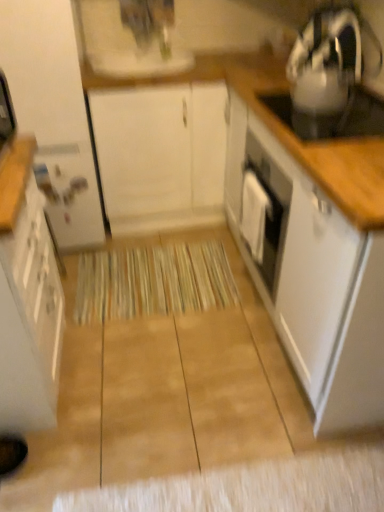
Question: From the image's perspective, relative to metallic silver kettle at upper right, is beige textured mat at center above or below?

Choices:
 (A) below
 (B) above

Answer: (A)

Question: Considering the positions of beige textured mat at center and metallic silver kettle at upper right in the image, is beige textured mat at center wider or thinner than metallic silver kettle at upper right?

Choices:
 (A) thin
 (B) wide

Answer: (B)

Question: Which of these objects is positioned farthest from the white glossy cabinet at left, which ranks as the 1th cabinetry in left-to-right order?

Choices:
 (A) white glossy cabinet at left, the third cabinetry from the right
 (B) beige textured mat at center
 (C) white glossy sink at upper center
 (D) white matte cabinet at center, the 2th cabinetry when ordered from right to left
 (E) white glossy cabinet at right, arranged as the first cabinetry when viewed from the right

Answer: (E)

Question: Which object is positioned farthest from the beige textured mat at center?

Choices:
 (A) metallic silver kettle at upper right
 (B) white glossy cabinet at left, which ranks as the 1th cabinetry in left-to-right order
 (C) white glossy cabinet at right, which ranks as the 4th cabinetry in left-to-right order
 (D) white matte cabinet at center, the 2th cabinetry when ordered from right to left
 (E) white glossy sink at upper center

Answer: (E)